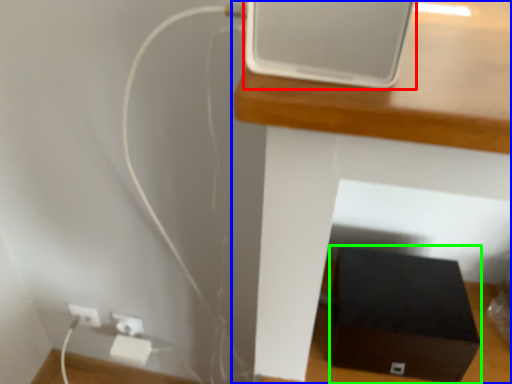
Question: Which is nearer to the ipod (highlighted by a red box)? furniture (highlighted by a blue box) or box (highlighted by a green box).

Choices:
 (A) furniture
 (B) box

Answer: (A)